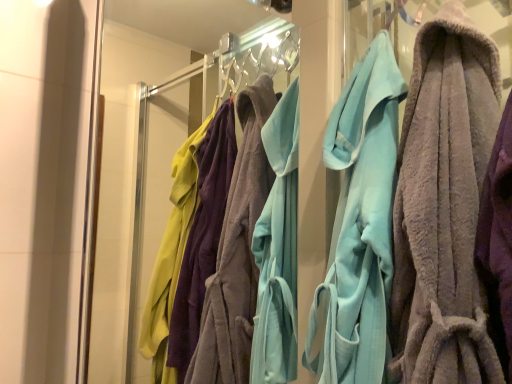
Question: Is light blue plush robe at center, acting as the 2th towel starting from the front, bigger than soft gray towel at center, marked as the 1th towel in a front-to-back arrangement?

Choices:
 (A) no
 (B) yes

Answer: (A)

Question: Can you confirm if light blue plush robe at center, acting as the 2th towel starting from the front, is smaller than soft gray towel at center, marked as the 1th towel in a front-to-back arrangement?

Choices:
 (A) yes
 (B) no

Answer: (A)

Question: Is light blue plush robe at center, acting as the 2th towel starting from the front, at the right side of soft gray towel at center, marked as the 1th towel in a front-to-back arrangement?

Choices:
 (A) yes
 (B) no

Answer: (B)

Question: Is light blue plush robe at center, acting as the 2th towel starting from the front, in front of soft gray towel at center, marked as the 1th towel in a front-to-back arrangement?

Choices:
 (A) no
 (B) yes

Answer: (A)

Question: From a real-world perspective, is light blue plush robe at center, acting as the 2th towel starting from the front, on top of soft gray towel at center, marked as the second towel in a back-to-front arrangement?

Choices:
 (A) no
 (B) yes

Answer: (A)

Question: Is soft gray towel at center, marked as the 1th towel in a front-to-back arrangement, inside the boundaries of transparent glass door at center, or outside?

Choices:
 (A) inside
 (B) outside

Answer: (B)

Question: Is point (430, 377) positioned closer to the camera than point (133, 379)?

Choices:
 (A) closer
 (B) farther

Answer: (A)

Question: In terms of size, does soft gray towel at center, marked as the 1th towel in a front-to-back arrangement, appear bigger or smaller than transparent glass door at center?

Choices:
 (A) big
 (B) small

Answer: (B)

Question: Relative to transparent glass door at center, is soft gray towel at center, marked as the second towel in a back-to-front arrangement, in front or behind?

Choices:
 (A) behind
 (B) front

Answer: (B)

Question: Considering the positions of soft gray towel at center, marked as the second towel in a back-to-front arrangement, and light blue plush robe at center, arranged as the first towel when viewed from the back, in the image, is soft gray towel at center, marked as the second towel in a back-to-front arrangement, wider or thinner than light blue plush robe at center, arranged as the first towel when viewed from the back,?

Choices:
 (A) wide
 (B) thin

Answer: (A)

Question: Is soft gray towel at center, marked as the 1th towel in a front-to-back arrangement, bigger or smaller than light blue plush robe at center, acting as the 2th towel starting from the front?

Choices:
 (A) big
 (B) small

Answer: (A)

Question: From the image's perspective, is soft gray towel at center, marked as the 1th towel in a front-to-back arrangement, above or below light blue plush robe at center, arranged as the first towel when viewed from the back?

Choices:
 (A) below
 (B) above

Answer: (B)

Question: From their relative heights in the image, would you say soft gray towel at center, marked as the 1th towel in a front-to-back arrangement, is taller or shorter than light blue plush robe at center, arranged as the first towel when viewed from the back?

Choices:
 (A) short
 (B) tall

Answer: (A)

Question: Considering their positions, is light blue plush robe at center, arranged as the first towel when viewed from the back, located in front of or behind soft gray towel at center, marked as the 1th towel in a front-to-back arrangement?

Choices:
 (A) front
 (B) behind

Answer: (B)

Question: From a real-world perspective, is light blue plush robe at center, acting as the 2th towel starting from the front, physically located above or below soft gray towel at center, marked as the 1th towel in a front-to-back arrangement?

Choices:
 (A) above
 (B) below

Answer: (B)